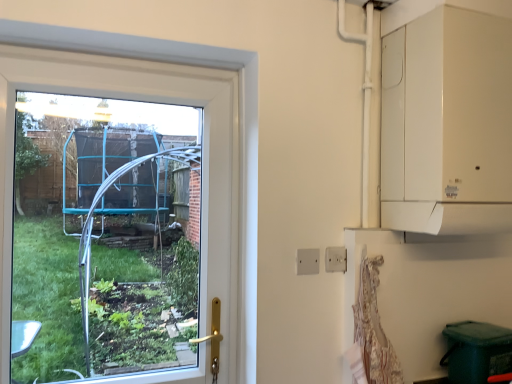
Describe the element at coordinates (152, 101) in the screenshot. I see `transparent glass window at left` at that location.

Where is `transparent glass window at left`? transparent glass window at left is located at coordinates (152, 101).

Locate an element on the screen. The image size is (512, 384). white plastic electric outlet at center is located at coordinates (336, 259).

The width and height of the screenshot is (512, 384). Describe the element at coordinates (336, 259) in the screenshot. I see `white plastic electric outlet at center` at that location.

You are a GUI agent. You are given a task and a screenshot of the screen. Output one action in this format:
    pyautogui.click(x=<x>, y=<y>)
    Task: Click on the transparent glass window at left
    
    Given the screenshot: What is the action you would take?
    pyautogui.click(x=152, y=101)

Would you say white plastic electric outlet at center is to the left or to the right of transparent glass window at left in the picture?

white plastic electric outlet at center is positioned on transparent glass window at left's right side.

Which object is further away from the camera, white plastic electric outlet at center or transparent glass window at left?

white plastic electric outlet at center is behind.

Which is behind, point (328, 248) or point (3, 110)?

Positioned behind is point (328, 248).

From the image's perspective, is white plastic electric outlet at center on transparent glass window at left?

No, from the image's perspective, white plastic electric outlet at center is not on top of transparent glass window at left.

From a real-world perspective, is white plastic electric outlet at center positioned over transparent glass window at left based on gravity?

No, from a real-world perspective, white plastic electric outlet at center is not over transparent glass window at left

Does white plastic electric outlet at center have a greater width compared to transparent glass window at left?

Incorrect, the width of white plastic electric outlet at center does not surpass that of transparent glass window at left.

Considering the sizes of white plastic electric outlet at center and transparent glass window at left in the image, is white plastic electric outlet at center taller or shorter than transparent glass window at left?

white plastic electric outlet at center is shorter than transparent glass window at left.

Considering the sizes of objects white plastic electric outlet at center and transparent glass window at left in the image provided, who is smaller, white plastic electric outlet at center or transparent glass window at left?

With smaller size is white plastic electric outlet at center.

Is white plastic electric outlet at center not within transparent glass window at left?

That's correct, white plastic electric outlet at center is outside of transparent glass window at left.

Is white plastic electric outlet at center next to transparent glass window at left and touching it?

No, white plastic electric outlet at center is not touching transparent glass window at left.

Is white plastic electric outlet at center positioned with its back to transparent glass window at left?

No, white plastic electric outlet at center is not facing the opposite direction of transparent glass window at left.

This screenshot has height=384, width=512. What are the coordinates of `window on the left side of white plastic electric outlet at center` in the screenshot? It's located at [x=152, y=101].

Can you confirm if transparent glass window at left is positioned to the left of white plastic electric outlet at center?

Yes, transparent glass window at left is to the left of white plastic electric outlet at center.

Is transparent glass window at left positioned in front of white plastic electric outlet at center?

That is True.

Does point (123, 376) appear closer or farther from the camera than point (343, 247)?

Point (123, 376).

From the image's perspective, is transparent glass window at left above or below white plastic electric outlet at center?

Based on their image positions, transparent glass window at left is located above white plastic electric outlet at center.

From a real-world perspective, which is physically below, transparent glass window at left or white plastic electric outlet at center?

white plastic electric outlet at center, from a real-world perspective.

Can you confirm if transparent glass window at left is thinner than white plastic electric outlet at center?

No, transparent glass window at left is not thinner than white plastic electric outlet at center.

Considering the relative sizes of transparent glass window at left and white plastic electric outlet at center in the image provided, is transparent glass window at left taller than white plastic electric outlet at center?

Indeed, transparent glass window at left has a greater height compared to white plastic electric outlet at center.

Which of these two, transparent glass window at left or white plastic electric outlet at center, is smaller?

Smaller between the two is white plastic electric outlet at center.

Is transparent glass window at left inside or outside of white plastic electric outlet at center?

transparent glass window at left is not inside white plastic electric outlet at center, it's outside.

Is transparent glass window at left positioned far away from white plastic electric outlet at center?

They are positioned close to each other.

Could you tell me if transparent glass window at left is turned towards white plastic electric outlet at center?

No, transparent glass window at left is not turned towards white plastic electric outlet at center.

How different are the orientations of transparent glass window at left and white plastic electric outlet at center in degrees?

The angle between the facing direction of transparent glass window at left and the facing direction of white plastic electric outlet at center is 0.00425 degrees.

This screenshot has width=512, height=384. I want to click on window that appears in front of the white plastic electric outlet at center, so click(152, 101).

At what (x,y) coordinates should I click in order to perform the action: click on window that is above the white plastic electric outlet at center (from the image's perspective). Please return your answer as a coordinate pair (x, y). This screenshot has width=512, height=384. Looking at the image, I should click on (152, 101).

Where is `window above the white plastic electric outlet at center (from a real-world perspective)`? window above the white plastic electric outlet at center (from a real-world perspective) is located at coordinates (152, 101).